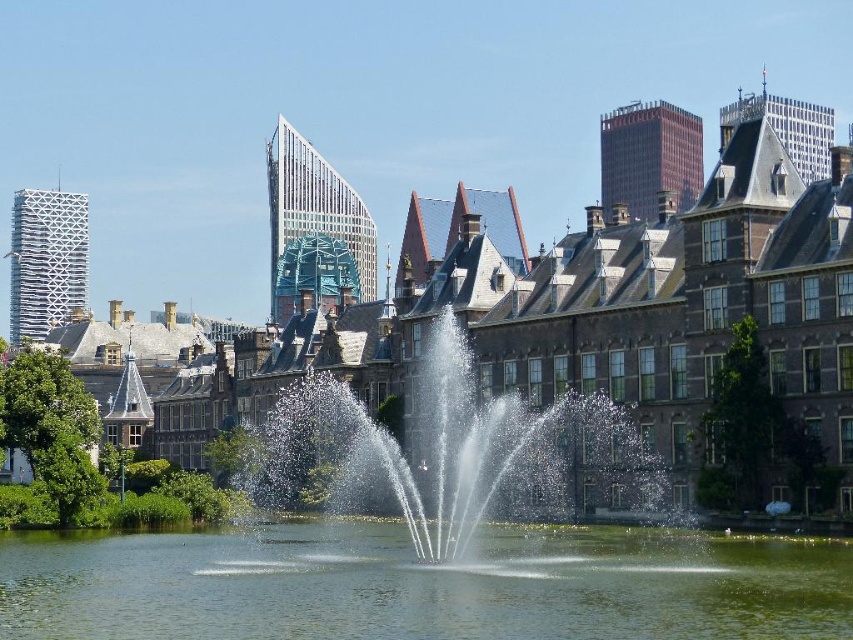
You are standing at the edge of the clear water at center and want to walk to the clear water fountain at center. Which direction should you go to reach the fountain?

The clear water fountain at center is taller than the clear water at center, so you should walk towards the taller structure to reach the fountain.

Based on the provided scene description, what are the coordinates of the clear water at center in the image?

The clear water at center is located at coordinates point (421, 586).